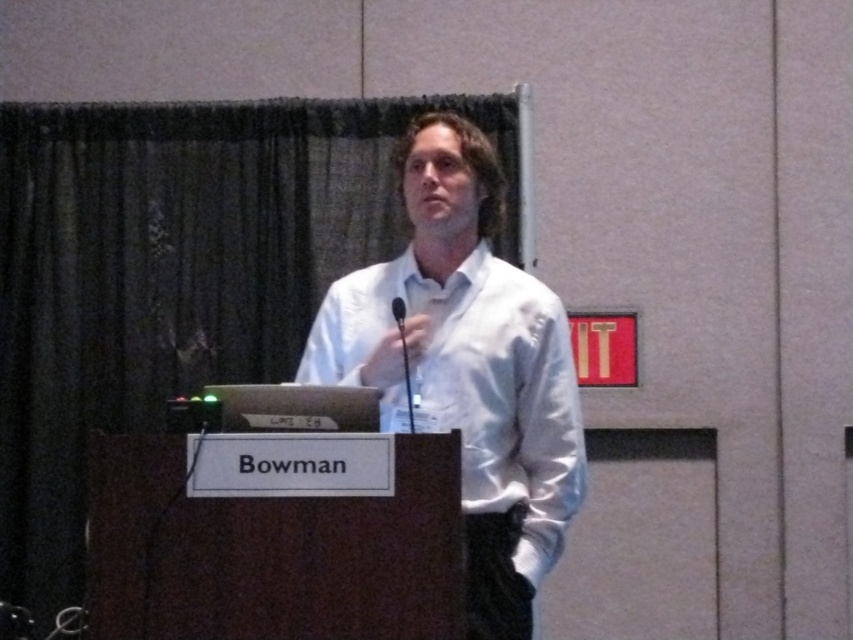
Question: Is white satin shirt at center smaller than black matte microphone at center?

Choices:
 (A) yes
 (B) no

Answer: (B)

Question: Is white satin shirt at center smaller than black matte microphone at center?

Choices:
 (A) no
 (B) yes

Answer: (A)

Question: Which object is closer to the camera taking this photo?

Choices:
 (A) white satin shirt at center
 (B) black matte microphone at center

Answer: (A)

Question: Which point is closer to the camera?

Choices:
 (A) (x=413, y=419)
 (B) (x=416, y=164)

Answer: (A)

Question: Is white satin shirt at center to the right of black matte microphone at center from the viewer's perspective?

Choices:
 (A) yes
 (B) no

Answer: (A)